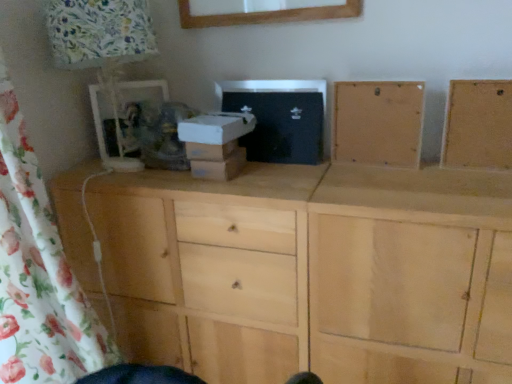
Locate an element on the screen. vacant point to the left of white cardboard box at center is located at coordinates (150, 175).